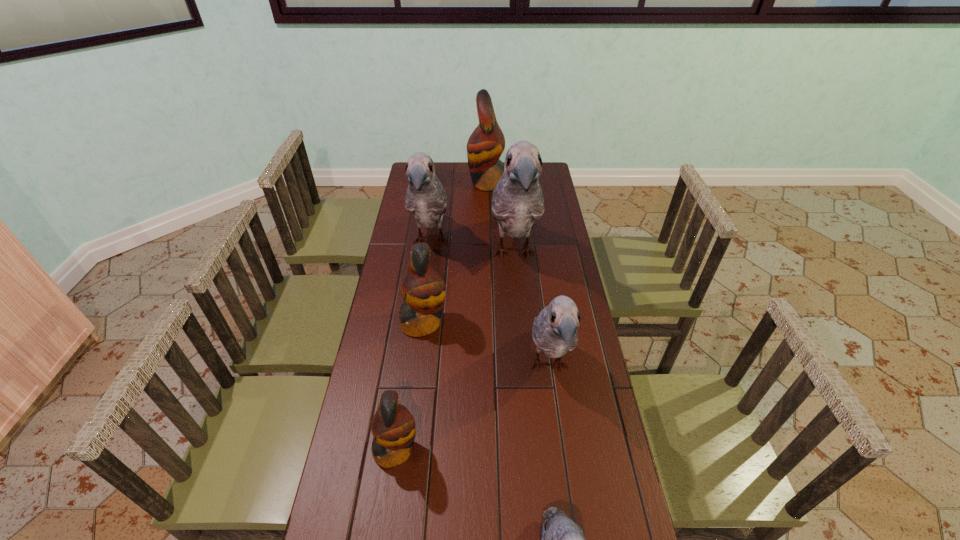
In the image, there is a desktop. What are the coordinates of `vacant space at the far right corner` in the screenshot? It's located at (551, 171).

This screenshot has height=540, width=960. Find the location of `vacant area that lies between the second nearest object and the second smallest red parrot`. vacant area that lies between the second nearest object and the second smallest red parrot is located at coordinates (410, 386).

I want to click on blank region between the nearest red parrot and the second smallest gray parrot, so click(x=472, y=408).

This screenshot has width=960, height=540. In order to click on vacant area that lies between the second biggest gray parrot and the smallest red parrot in this screenshot , I will do `click(413, 346)`.

I want to click on unoccupied area between the farthest red parrot and the leftmost gray parrot, so click(x=459, y=212).

I want to click on unoccupied position between the tallest parrot and the second nearest object, so click(x=455, y=352).

Identify which object is the second nearest to the second farthest red parrot. Please provide its 2D coordinates. Your answer should be formatted as a tuple, i.e. [(x, y)], where the tuple contains the x and y coordinates of a point satisfying the conditions above.

[(426, 199)]

Locate an element on the screen. This screenshot has width=960, height=540. the fifth closest object to the smallest gray parrot is located at coordinates (426, 199).

Point out which parrot is positioned as the sixth nearest to the smallest red parrot. Please provide its 2D coordinates. Your answer should be formatted as a tuple, i.e. [(x, y)], where the tuple contains the x and y coordinates of a point satisfying the conditions above.

[(486, 144)]

Locate which parrot ranks second in proximity to the nearest gray parrot. Please provide its 2D coordinates. Your answer should be formatted as a tuple, i.e. [(x, y)], where the tuple contains the x and y coordinates of a point satisfying the conditions above.

[(393, 426)]